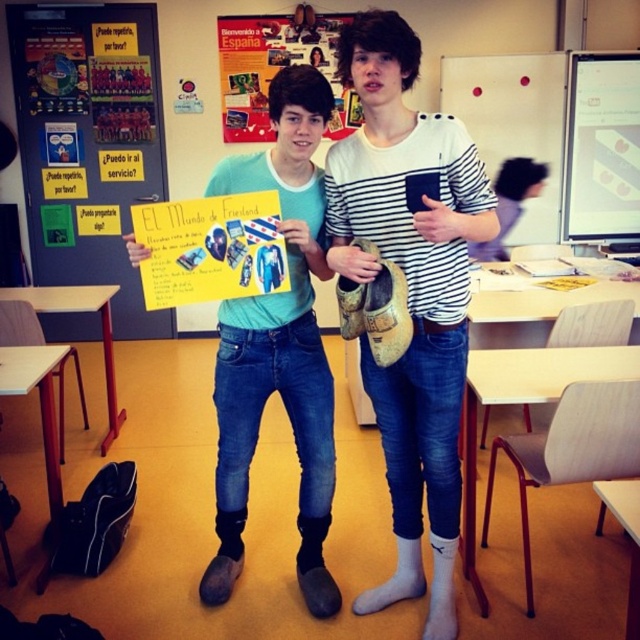
You are an observer standing in front of the classroom scene. You notice the striped cotton shirt at center and the matte paper poster at upper center. Which object is closer to you?

The striped cotton shirt at center is closer to you because it is in front of the matte paper poster at upper center.

You are organizing a cultural event and need to display both the striped cotton shirt at center and the matte paper poster at upper center on a wall. If the wall has limited space, which item should you prioritize placing first to ensure both can fit?

The striped cotton shirt at center has a lesser width compared to the matte paper poster at upper center, so you should prioritize placing the matte paper poster at upper center first to accommodate its larger width, then fit the striped cotton shirt at center alongside it.